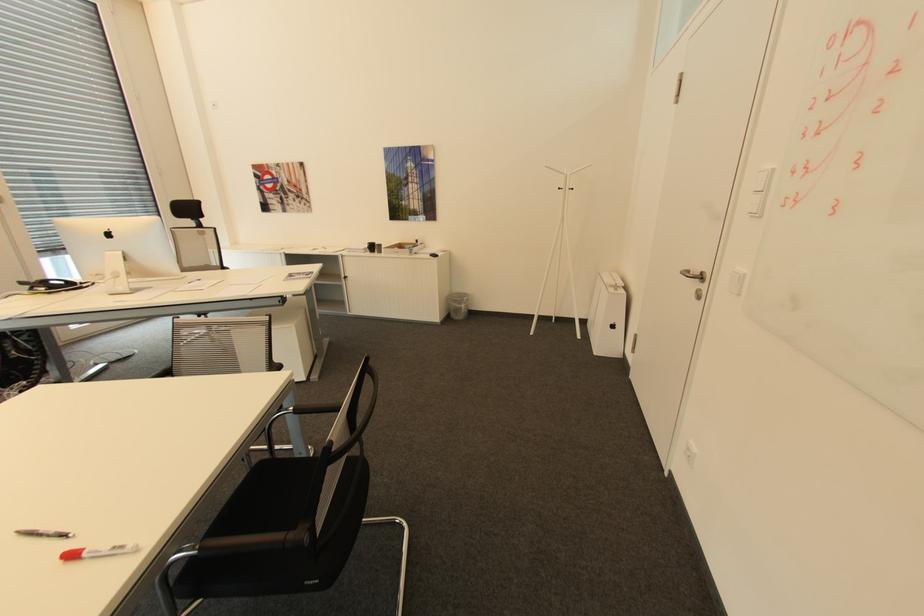
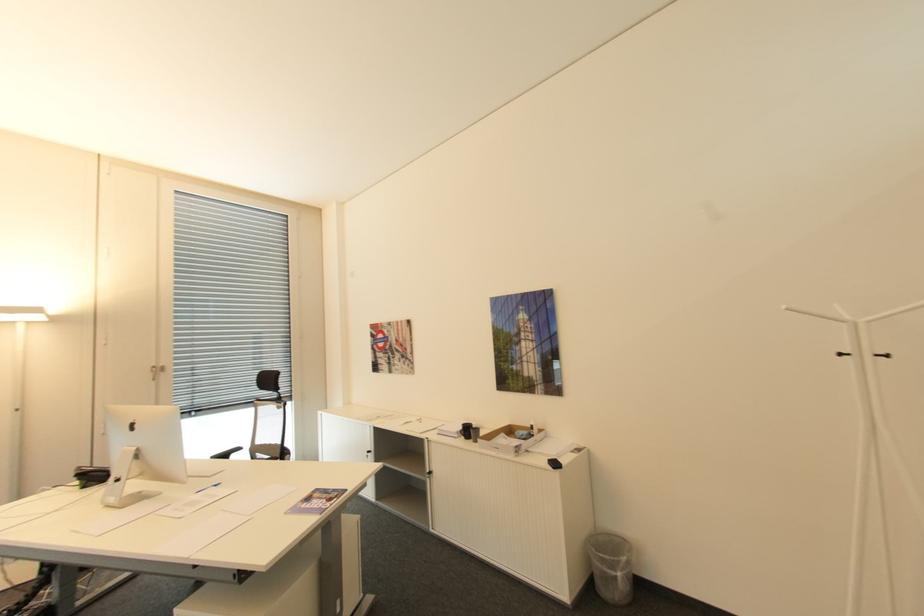
Where in the second image is the point corresponding to point (577, 188) from the first image?

(894, 355)